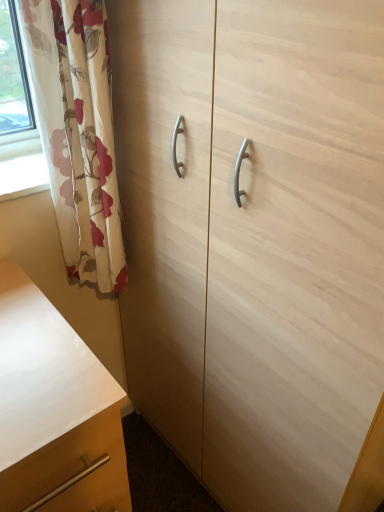
Question: Based on their positions, is floral fabric curtain at left located to the left or right of light wood cabinet at center?

Choices:
 (A) right
 (B) left

Answer: (B)

Question: Is floral fabric curtain at left bigger or smaller than light wood cabinet at center?

Choices:
 (A) big
 (B) small

Answer: (B)

Question: Which is farther from the light wood cabinet at center?

Choices:
 (A) floral fabric curtain at left
 (B) matte wood chest of drawers at lower left

Answer: (B)

Question: Which is farther from the floral fabric curtain at left?

Choices:
 (A) matte wood chest of drawers at lower left
 (B) light wood cabinet at center

Answer: (A)